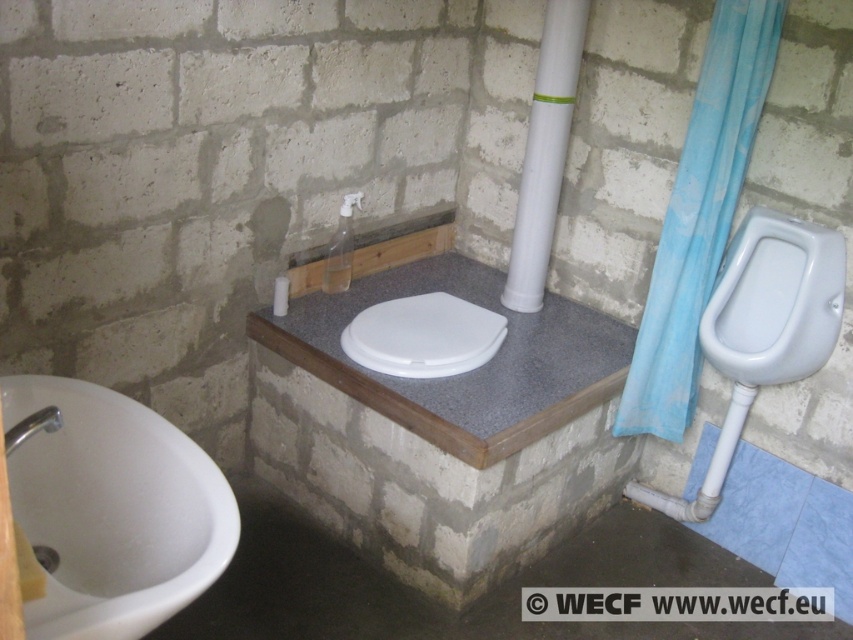
The width and height of the screenshot is (853, 640). Find the location of `white glossy sink at lower left`. white glossy sink at lower left is located at coordinates (113, 509).

Can you confirm if white glossy sink at lower left is taller than white plastic bidet at center?

Indeed, white glossy sink at lower left has a greater height compared to white plastic bidet at center.

Who is more forward, (97, 392) or (450, 362)?

Point (97, 392) is in front.

The image size is (853, 640). Identify the location of white glossy sink at lower left. (113, 509).

Does point (173, 452) come behind point (543, 428)?

That is False.

Between white glossy sink at lower left and gray laminate toilet at center, which one is positioned lower?

white glossy sink at lower left is below.

Does point (65, 444) lie in front of point (418, 291)?

Yes.

Locate an element on the screen. white glossy sink at lower left is located at coordinates (113, 509).

Is blue fabric curtain at right behind white plastic bidet at center?

No, it is in front of white plastic bidet at center.

Is blue fabric curtain at right bigger than white plastic bidet at center?

Yes.

Between point (721, 204) and point (461, 333), which one is positioned behind?

The point (461, 333) is behind.

Where is `blue fabric curtain at right`? The width and height of the screenshot is (853, 640). blue fabric curtain at right is located at coordinates (699, 216).